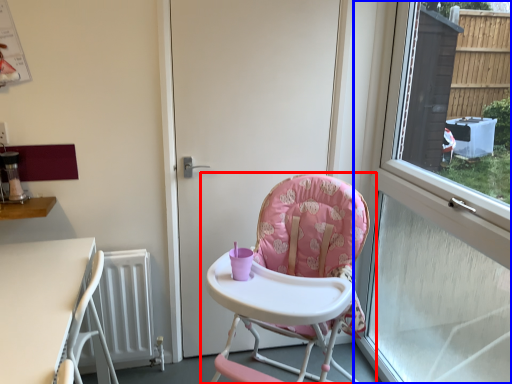
Question: Among these objects, which one is nearest to the camera, chair (highlighted by a red box) or window (highlighted by a blue box)?

Choices:
 (A) chair
 (B) window

Answer: (B)